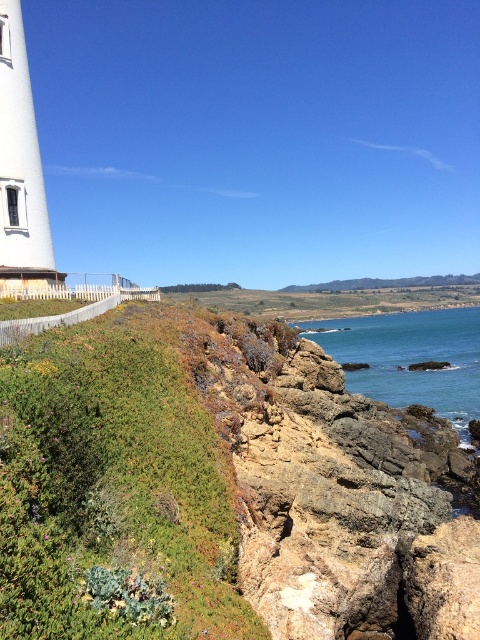
Between green grassy hillside at lower left and blue water at lower right, which one appears on the left side from the viewer's perspective?

From the viewer's perspective, green grassy hillside at lower left appears more on the left side.

Does point (82, 444) lie behind point (409, 344)?

That is False.

The width and height of the screenshot is (480, 640). In order to click on green grassy hillside at lower left in this screenshot , I will do `click(224, 486)`.

Between point (44, 572) and point (19, 100), which one is positioned in front?

Point (44, 572) is in front.

Does green grassy hillside at lower left appear under white matte lighthouse at left?

Indeed, green grassy hillside at lower left is positioned under white matte lighthouse at left.

Where is `green grassy hillside at lower left`? This screenshot has height=640, width=480. green grassy hillside at lower left is located at coordinates click(224, 486).

Is point (458, 412) positioned behind point (6, 36)?

That is True.

Who is more forward, (468, 308) or (23, 148)?

Point (23, 148) is more forward.

Who is more forward, (412, 317) or (10, 81)?

Positioned in front is point (10, 81).

Locate an element on the screen. blue water at lower right is located at coordinates 409,358.